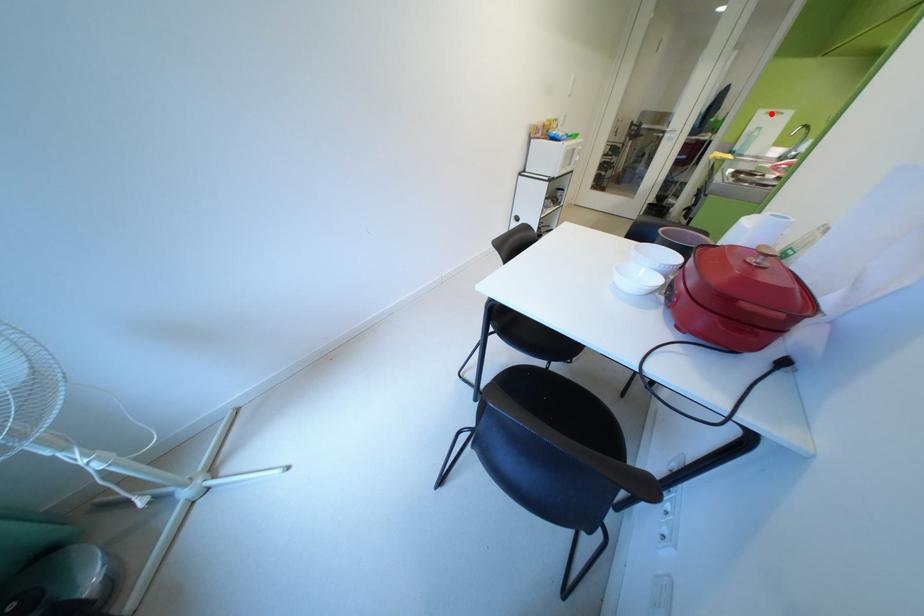
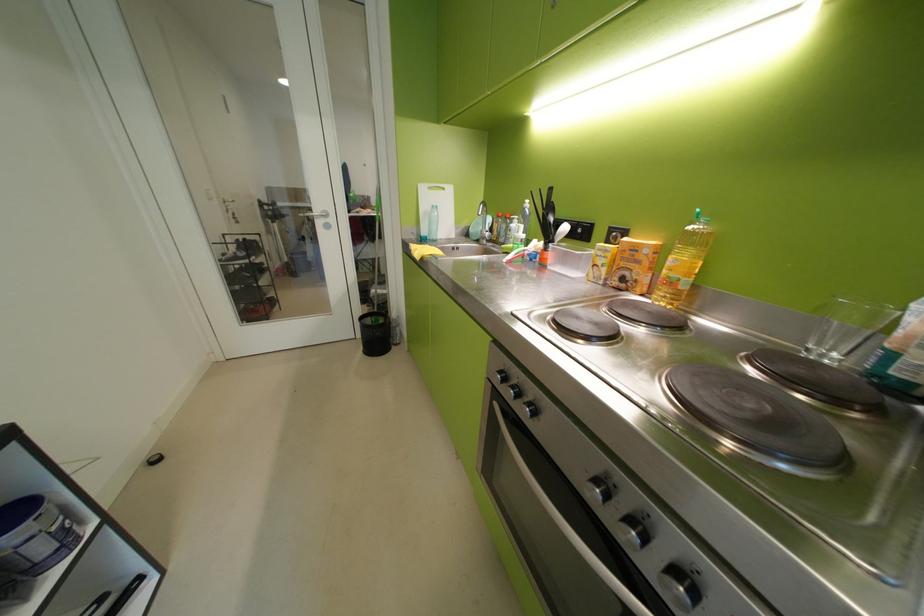
Question: A red point is marked in image1. In image2, is the corresponding 3D point closer to the camera or farther? Reply with the corresponding letter.

Choices:
 (A) The corresponding 3D point is closer.
 (B) The corresponding 3D point is farther.

Answer: (A)